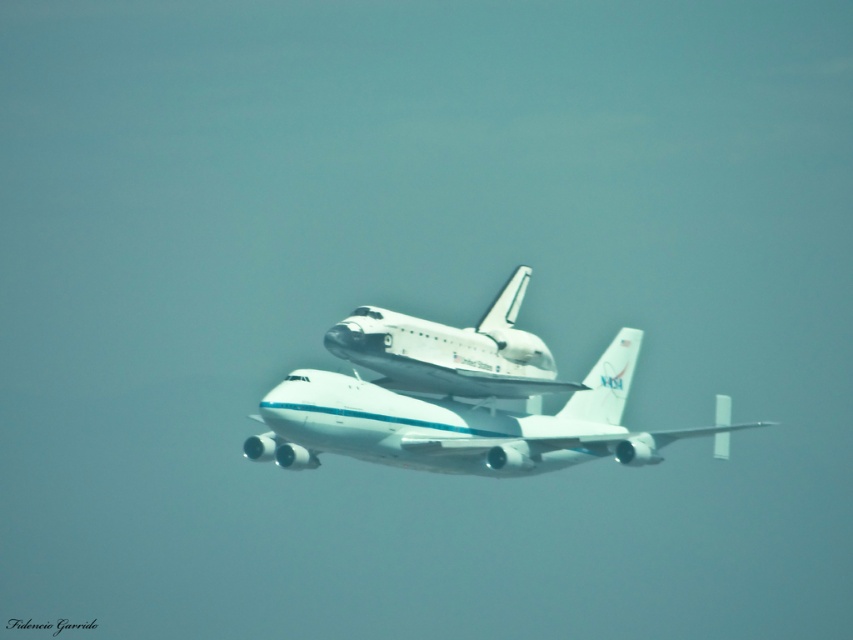
Question: Which point is farther from the camera taking this photo?

Choices:
 (A) (618, 456)
 (B) (401, 376)

Answer: (B)

Question: Does white glossy airplane at center have a lesser width compared to white glossy shuttle at center?

Choices:
 (A) yes
 (B) no

Answer: (B)

Question: From the image, what is the correct spatial relationship of white glossy airplane at center in relation to white glossy shuttle at center?

Choices:
 (A) below
 (B) above

Answer: (A)

Question: Is white glossy airplane at center in front of white glossy shuttle at center?

Choices:
 (A) no
 (B) yes

Answer: (B)